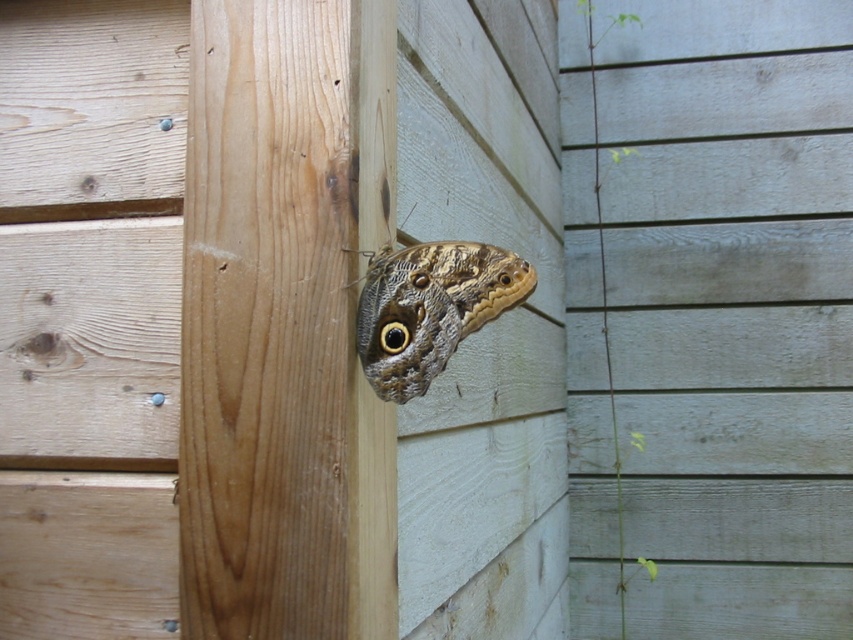
Between natural wood at center and brown textured butterfly at center, which one appears on the right side from the viewer's perspective?

Positioned to the right is brown textured butterfly at center.

Who is higher up, natural wood at center or brown textured butterfly at center?

brown textured butterfly at center is above.

The height and width of the screenshot is (640, 853). What do you see at coordinates (283, 323) in the screenshot?
I see `natural wood at center` at bounding box center [283, 323].

Where is `natural wood at center`? natural wood at center is located at coordinates (283, 323).